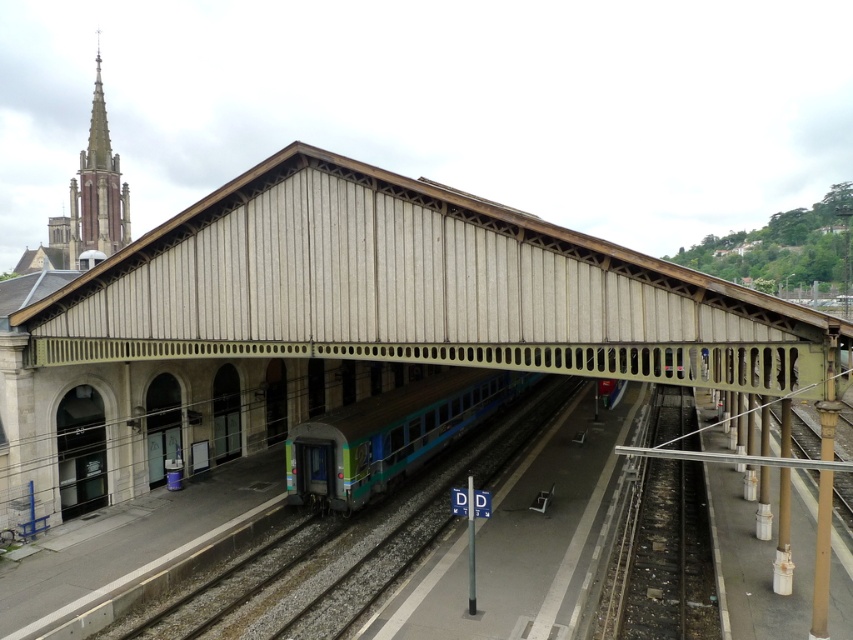
You are a maintenance worker needing to repair the smooth concrete train track at lower right. You have a tool that can only work on tracks wider than the teal glossy train at center. Can you use this tool on the track?

The smooth concrete train track at lower right is wider than the teal glossy train at center, so yes, the tool can be used on the track.

You are standing on the platform and see the smooth concrete train track at lower right and the teal glossy train at center. Which object is positioned to the right of the other?

The smooth concrete train track at lower right is to the right of the teal glossy train at center.

You are a passenger standing on the platform and want to board the teal glossy train at center. You notice the smooth concrete train track at lower right. Which object is closer to you as you stand on the platform?

The smooth concrete train track at lower right is closer to you because it is smaller than the teal glossy train at center, which suggests it is farther away.